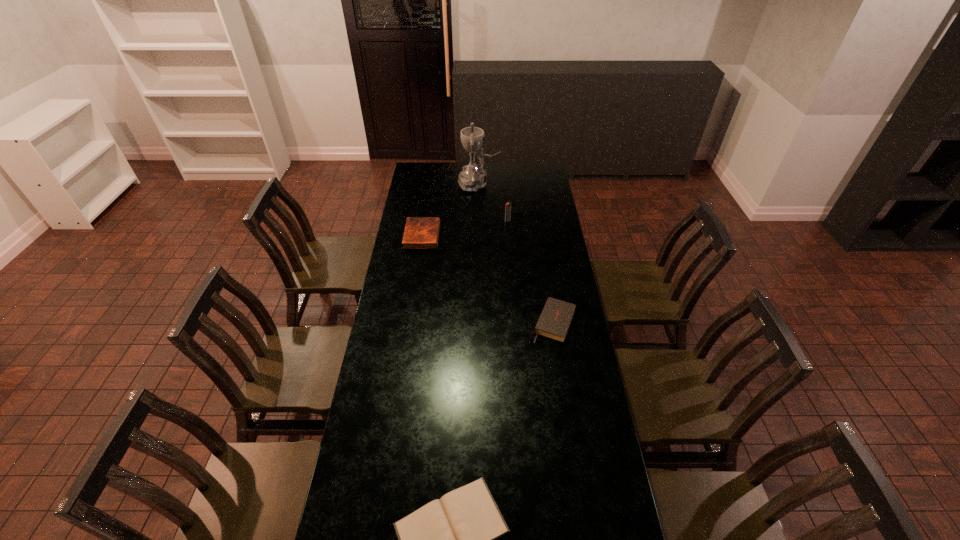
Where is `free point that satisfies the following two spatial constraints: 1. on the side with emblem of the second tallest object; 2. on the right side of the tallest object`? free point that satisfies the following two spatial constraints: 1. on the side with emblem of the second tallest object; 2. on the right side of the tallest object is located at coordinates tap(478, 221).

At what (x,y) coordinates should I click in order to perform the action: click on free space that satisfies the following two spatial constraints: 1. on the side with emblem of the rightmost Bible; 2. on the right side of the farthest object. Please return your answer as a coordinate pair (x, y). This screenshot has width=960, height=540. Looking at the image, I should click on (478, 322).